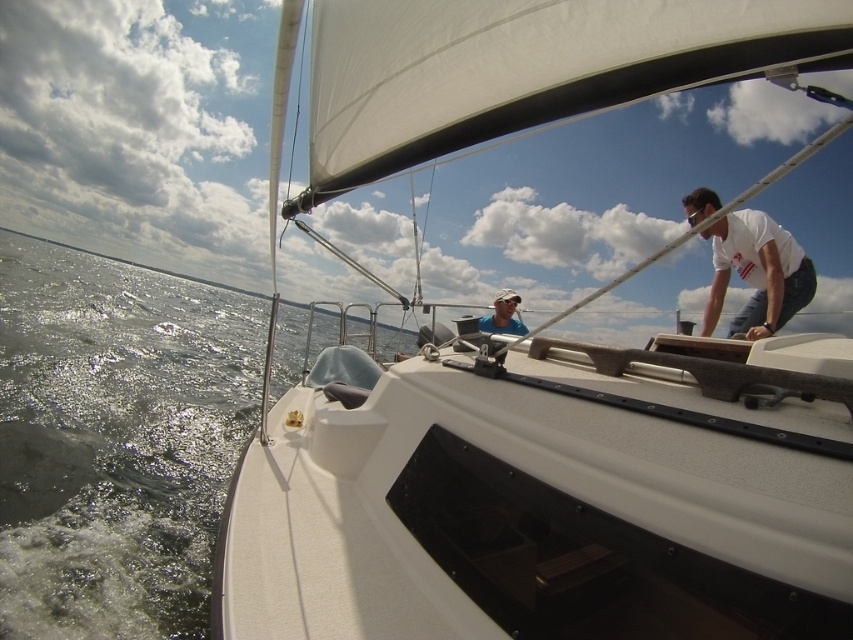
Image resolution: width=853 pixels, height=640 pixels. In order to click on greenish water at lower left in this screenshot , I will do [115, 440].

Is point (13, 240) positioned before point (479, 317)?

No, (13, 240) is further to viewer.

The image size is (853, 640). What do you see at coordinates (115, 440) in the screenshot? I see `greenish water at lower left` at bounding box center [115, 440].

Locate an element on the screen. The height and width of the screenshot is (640, 853). greenish water at lower left is located at coordinates (115, 440).

Who is more distant from viewer, (798,276) or (517,300)?

Point (517,300)

Can you confirm if white cotton shirt at upper right is smaller than matte blue shirt at center?

No.

Is point (808, 260) more distant than point (521, 332)?

No, it is in front of (521, 332).

In order to click on white cotton shirt at upper right in this screenshot , I will do `click(757, 273)`.

Is greenish water at lower left taller than white cotton shirt at upper right?

Indeed, greenish water at lower left has a greater height compared to white cotton shirt at upper right.

You are a GUI agent. You are given a task and a screenshot of the screen. Output one action in this format:
    pyautogui.click(x=<x>, y=<y>)
    Task: Click on the greenish water at lower left
    
    Given the screenshot: What is the action you would take?
    pyautogui.click(x=115, y=440)

At what (x,y) coordinates should I click in order to perform the action: click on greenish water at lower left. Please return your answer as a coordinate pair (x, y). Image resolution: width=853 pixels, height=640 pixels. Looking at the image, I should click on (115, 440).